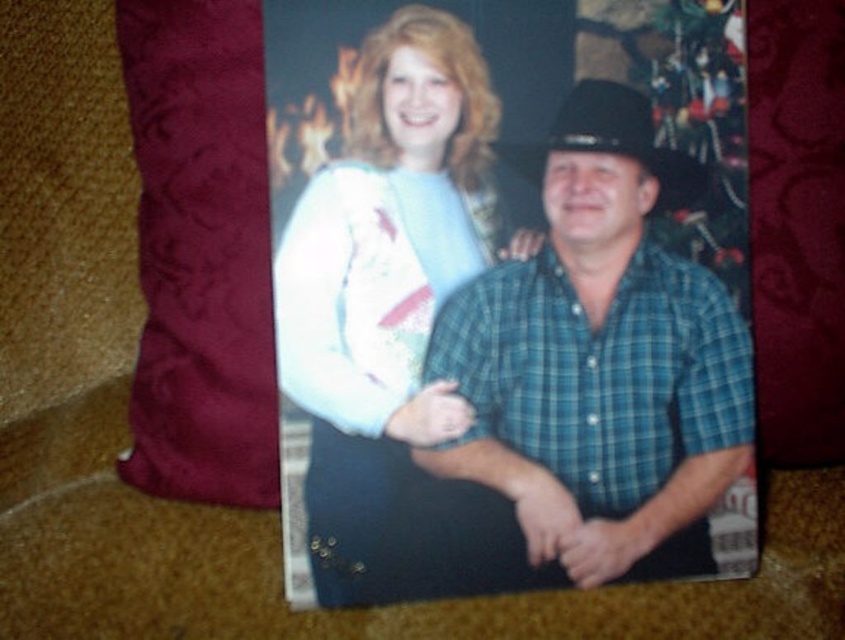
You are standing in a room where a photograph is placed on the floor. The photo shows a woman and a man sitting together near a fireplace. There is a velvet throw pillow in the scene. Based on the coordinates given, can you determine if the point at (200, 253) corresponds to the location of the velvet throw pillow?

The point at (200, 253) corresponds to the velvet throw pillow as stated in the description.